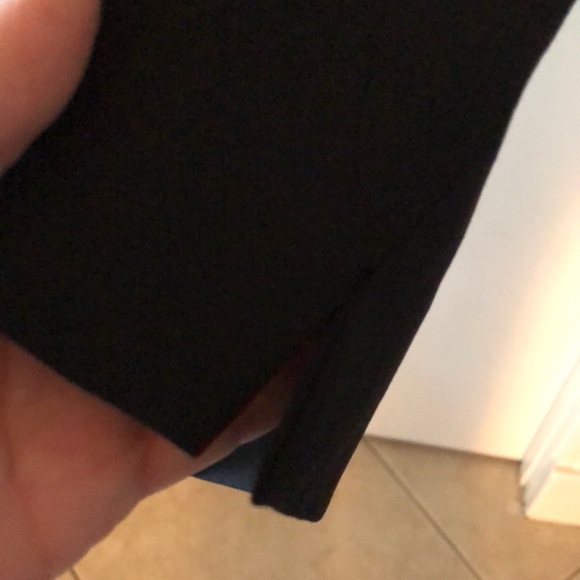
Locate an element on the screen. wall trim is located at coordinates (561, 495).